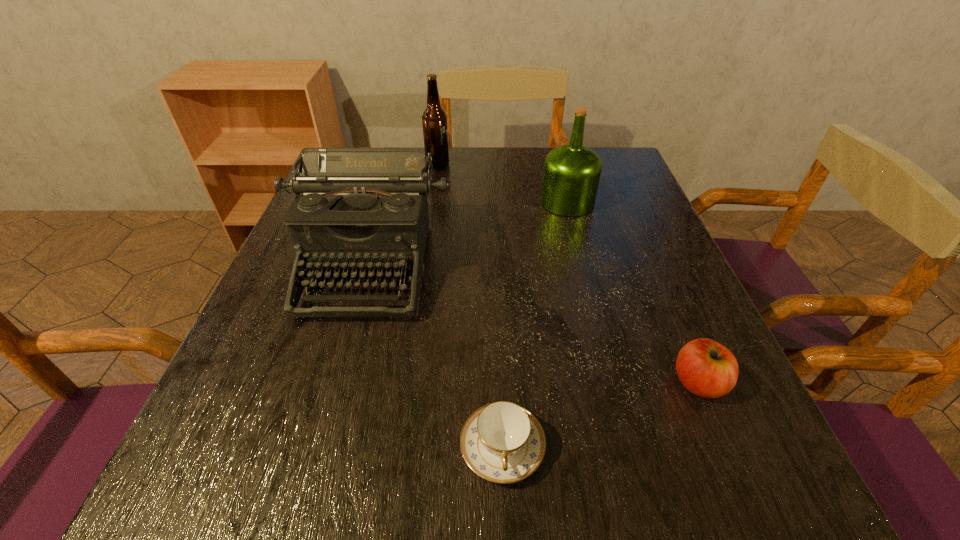
Find the location of a particular element. The image size is (960, 540). free location located 0.210m on the left of the fourth nearest object is located at coordinates (455, 202).

At what (x,y) coordinates should I click in order to perform the action: click on free region located on the typing side of the third tallest object. Please return your answer as a coordinate pair (x, y). Looking at the image, I should click on (311, 472).

At what (x,y) coordinates should I click in order to perform the action: click on vacant space located 0.080m on the front of the apple. Please return your answer as a coordinate pair (x, y). Image resolution: width=960 pixels, height=540 pixels. Looking at the image, I should click on (731, 459).

Locate an element on the screen. Image resolution: width=960 pixels, height=540 pixels. beer bottle that is at the far edge is located at coordinates (434, 118).

I want to click on olive oil at the far edge, so click(x=571, y=174).

You are a GUI agent. You are given a task and a screenshot of the screen. Output one action in this format:
    pyautogui.click(x=<x>, y=<y>)
    Task: Click on the object situated at the near edge
    The height and width of the screenshot is (540, 960).
    Given the screenshot: What is the action you would take?
    pyautogui.click(x=502, y=442)

Find the location of a particular element. object at the left edge is located at coordinates (360, 209).

This screenshot has height=540, width=960. What are the coordinates of `olive oil situated at the right edge` in the screenshot? It's located at (571, 174).

This screenshot has width=960, height=540. I want to click on apple situated at the right edge, so click(x=706, y=368).

Find the location of a particular element. Image resolution: width=960 pixels, height=540 pixels. object located in the far right corner section of the desktop is located at coordinates (571, 174).